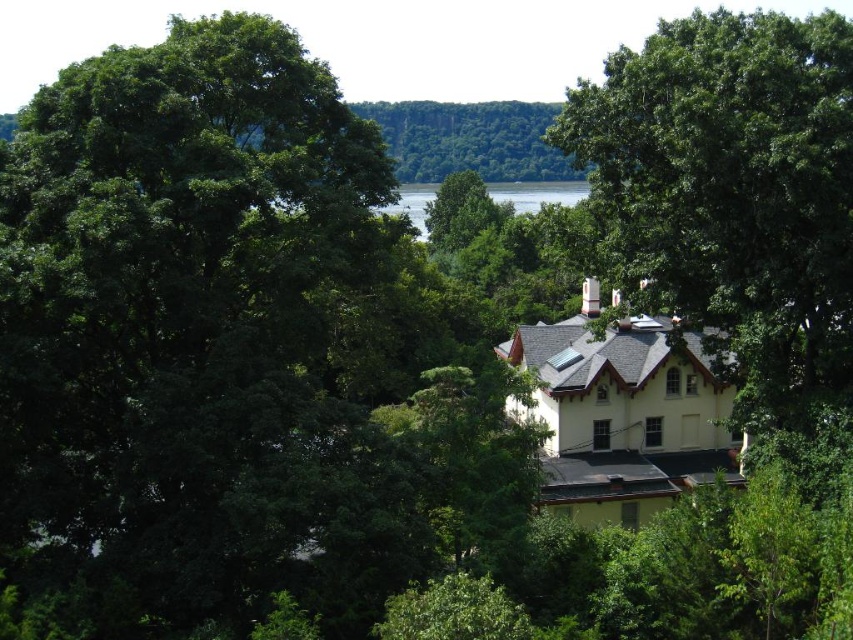
Question: Does green leafy tree at center have a smaller size compared to green water at center?

Choices:
 (A) yes
 (B) no

Answer: (A)

Question: Is green leafy tree at center further to the viewer compared to green water at center?

Choices:
 (A) yes
 (B) no

Answer: (B)

Question: Among these objects, which one is farthest from the camera?

Choices:
 (A) green water at center
 (B) green leafy tree at center

Answer: (A)

Question: Can you confirm if green leafy tree at center is bigger than green water at center?

Choices:
 (A) yes
 (B) no

Answer: (B)

Question: Which point is closer to the camera taking this photo?

Choices:
 (A) (706, 51)
 (B) (561, 186)

Answer: (A)